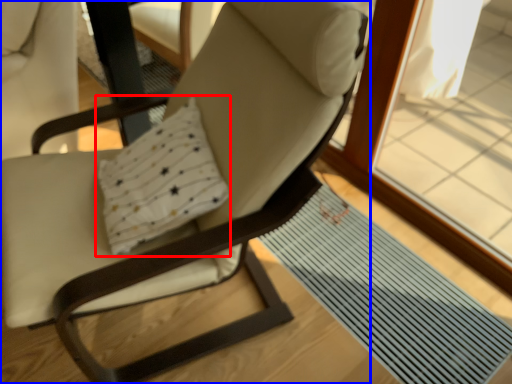
Question: Which object appears closest to the camera in this image, pillow (highlighted by a red box) or chair (highlighted by a blue box)?

Choices:
 (A) pillow
 (B) chair

Answer: (B)